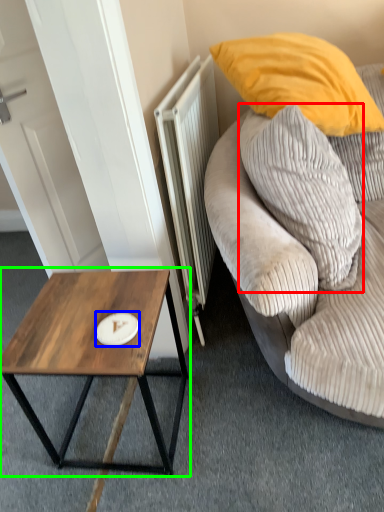
Question: Based on their relative distances, which object is nearer to pillow (highlighted by a red box)? Choose from plate (highlighted by a blue box) and coffee table (highlighted by a green box).

Choices:
 (A) plate
 (B) coffee table

Answer: (B)